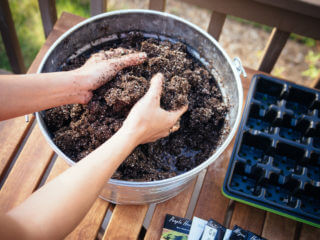
I want to click on wood rail, so click(269, 11).